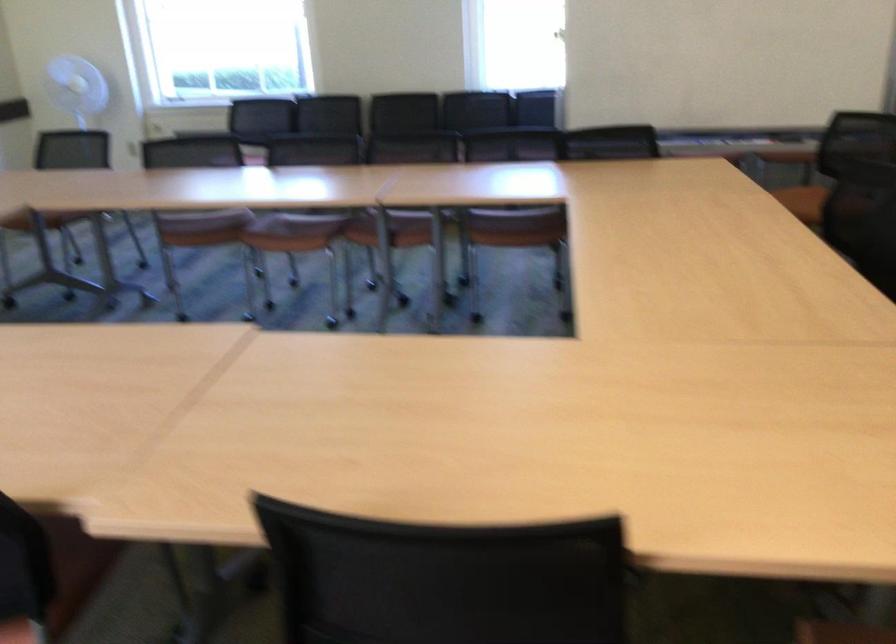
Find the location of `black chair sitting surface`. black chair sitting surface is located at coordinates (444, 579).